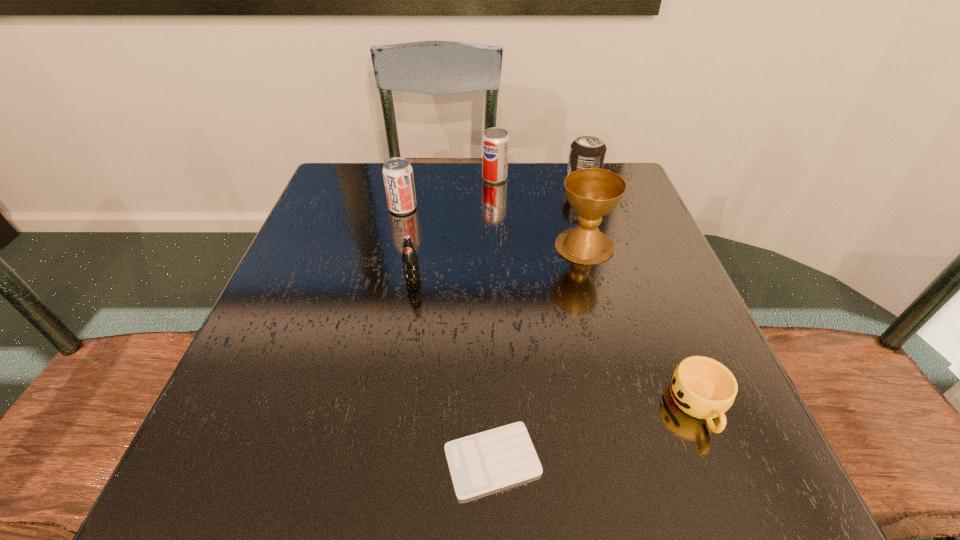
Identify the location of the second closest pop to the calculator. (397, 172).

The image size is (960, 540). Find the location of `blank area in the image that satisfies the following two spatial constraints: 1. on the front side of the sixth tallest object; 2. on the left side of the second pop from right to left`. blank area in the image that satisfies the following two spatial constraints: 1. on the front side of the sixth tallest object; 2. on the left side of the second pop from right to left is located at coordinates (505, 406).

This screenshot has height=540, width=960. What are the coordinates of `blank space that satisfies the following two spatial constraints: 1. on the front side of the fourth nearest object; 2. on the left side of the third farthest object` in the screenshot? It's located at (394, 246).